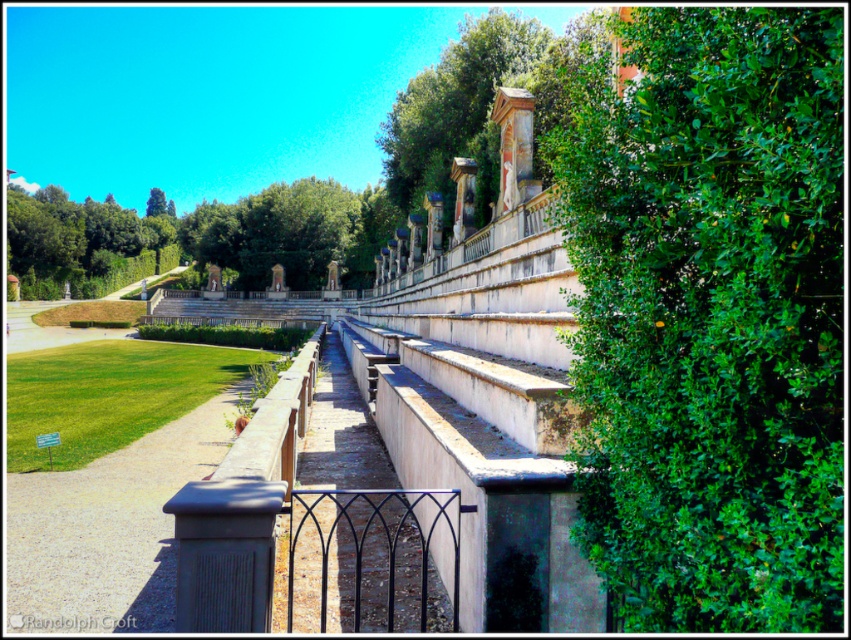
You are standing at the center of the garden pathway and want to place a small decorative pot exactly at the midpoint between the green leafy bush at right and the nearest edge of the lawn. What are the coordinates of that midpoint?

The coordinates of the midpoint between the green leafy bush at right and the nearest edge of the lawn would be halfway between the bush at point [710,316] and the edge of the lawn. Since the lawn is to the left of the pathway, the nearest edge of the lawn is at the left boundary of the pathway. Assuming the pathway is centered at 0.5 in the x and y axes, the midpoint would be calculated by averaging the coordinates. However, without specific coordinates for the lawn edge, the exact midpoint can be deduc

You are a gardener who needs to trim the green leafy bush at right and the black wrought iron fence at center. Which object is positioned higher relative to the other?

The green leafy bush at right is located above the black wrought iron fence at center, so it is positioned higher.

Looking at this image, you are standing at the entrance of the garden and want to take a photo of both point (377,586) and point (100,218). Which point should you focus on first to ensure both are in clear view?

Point (377,586) is closer to the camera than point (100,218), so you should focus on point (377,586) first to ensure both are in clear view.